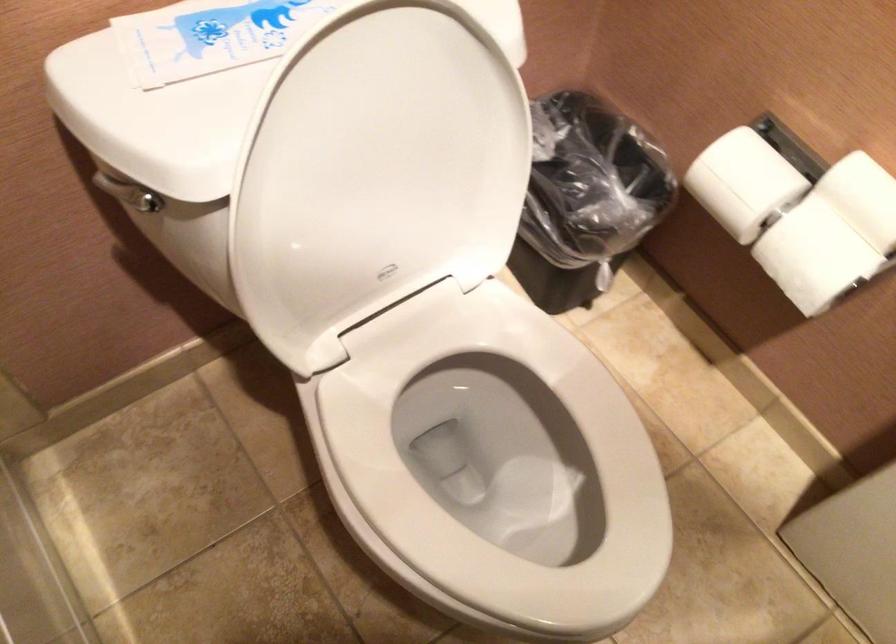
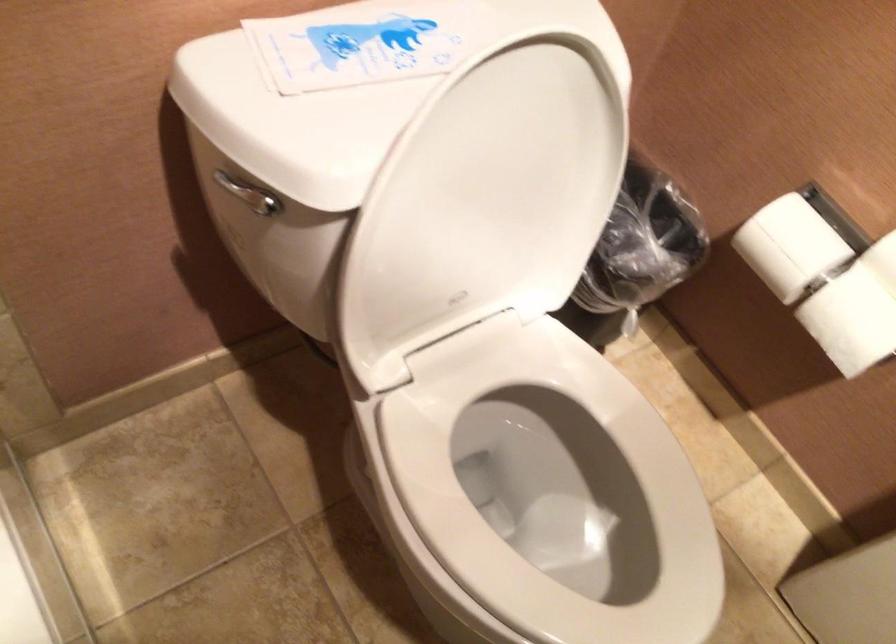
Find the pixel in the second image that matches [737,183] in the first image.

(789, 245)